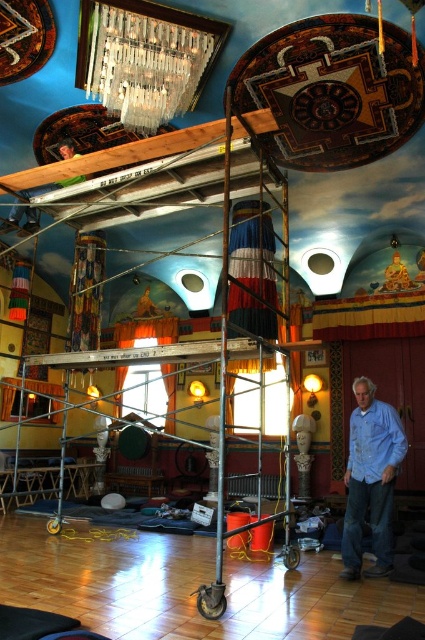
Question: Can you confirm if metallic glass chandelier at upper center is smaller than blue denim jeans at lower right?

Choices:
 (A) yes
 (B) no

Answer: (B)

Question: Can you confirm if metallic glass chandelier at upper center is bigger than blue denim jeans at lower right?

Choices:
 (A) no
 (B) yes

Answer: (B)

Question: Which point is farther from the camera taking this photo?

Choices:
 (A) (178, 35)
 (B) (376, 429)

Answer: (A)

Question: Among these points, which one is farthest from the camera?

Choices:
 (A) (391, 484)
 (B) (139, 44)

Answer: (B)

Question: Is metallic glass chandelier at upper center behind blue denim jeans at lower right?

Choices:
 (A) no
 (B) yes

Answer: (B)

Question: Which object appears closest to the camera in this image?

Choices:
 (A) blue denim jeans at lower right
 (B) metallic glass chandelier at upper center

Answer: (A)